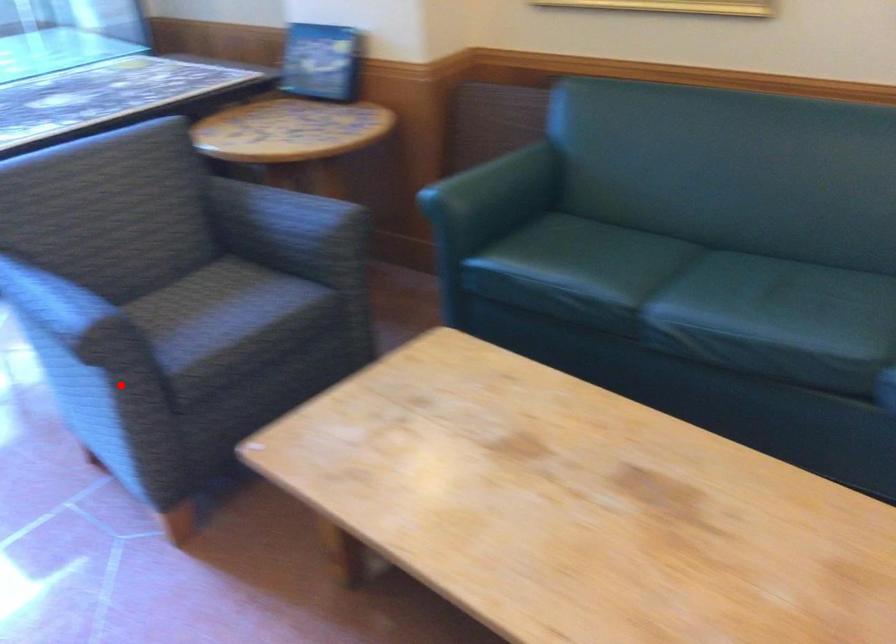
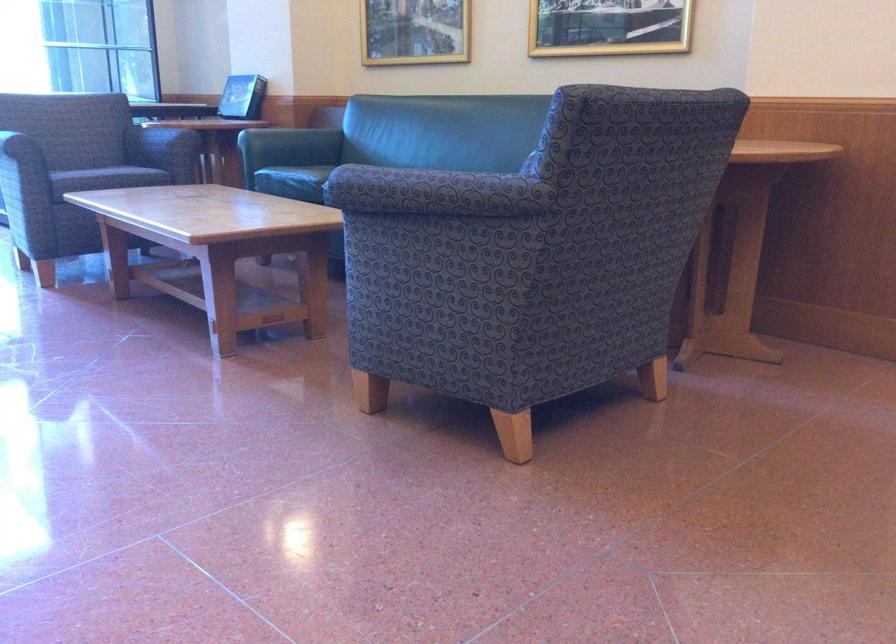
Locate, in the second image, the point that corresponds to the highlighted location in the first image.

(14, 146)